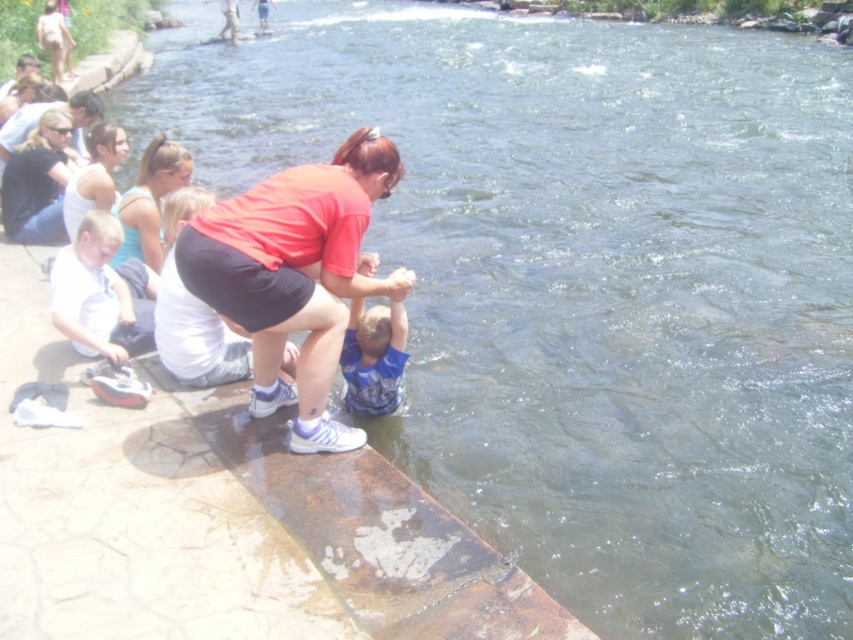
Does point (102, 342) come closer to viewer compared to point (80, 196)?

Yes, point (102, 342) is closer to viewer.

Is white cotton shirt at left wider than matte white tank top at upper left?

In fact, white cotton shirt at left might be narrower than matte white tank top at upper left.

Who is more forward, (94,323) or (115,196)?

Positioned in front is point (94,323).

In order to click on white cotton shirt at left in this screenshot , I will do (100, 292).

Can you confirm if matte red shirt at center is wider than blue cotton shirt at center?

Indeed, matte red shirt at center has a greater width compared to blue cotton shirt at center.

Is point (297, 262) in front of point (387, 369)?

Yes, point (297, 262) is closer to viewer.

This screenshot has width=853, height=640. What are the coordinates of `matte red shirt at center` in the screenshot? It's located at (294, 275).

Is matte black shorts at center wider than matte blue tank top at upper left?

Yes, matte black shorts at center is wider than matte blue tank top at upper left.

Does matte black shorts at center come in front of matte blue tank top at upper left?

Yes, matte black shorts at center is in front of matte blue tank top at upper left.

Identify the location of matte black shorts at center. This screenshot has width=853, height=640. (193, 314).

I want to click on matte black shorts at center, so click(x=193, y=314).